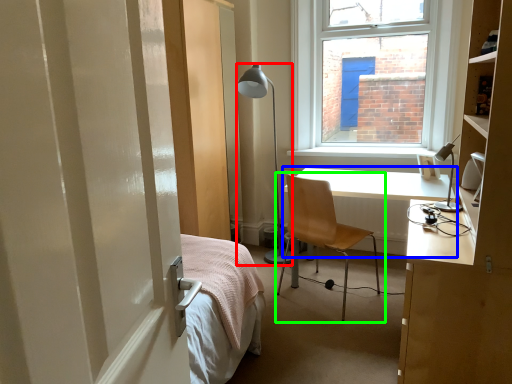
Question: Which object is the farthest from lamp (highlighted by a red box)? Choose among these: desk (highlighted by a blue box) or chair (highlighted by a green box).

Choices:
 (A) desk
 (B) chair

Answer: (B)